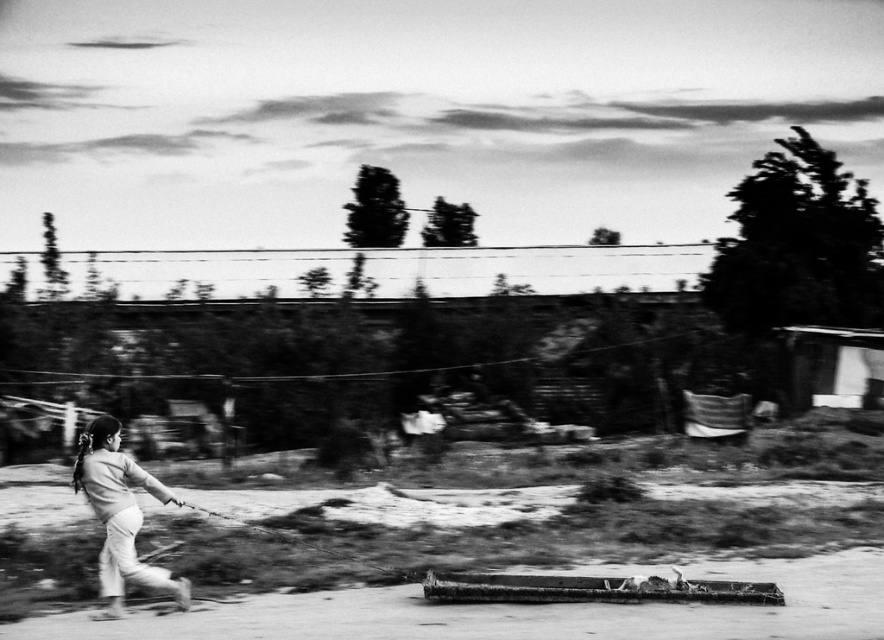
Question: Considering the relative positions of smooth dirt track at lower center and smooth skin girl at lower left in the image provided, where is smooth dirt track at lower center located with respect to smooth skin girl at lower left?

Choices:
 (A) right
 (B) left

Answer: (A)

Question: Can you confirm if smooth dirt track at lower center is wider than smooth skin girl at lower left?

Choices:
 (A) yes
 (B) no

Answer: (A)

Question: Among these points, which one is nearest to the camera?

Choices:
 (A) (234, 612)
 (B) (149, 476)

Answer: (A)

Question: Is smooth dirt track at lower center positioned in front of smooth skin girl at lower left?

Choices:
 (A) yes
 (B) no

Answer: (B)

Question: Among these objects, which one is farthest from the camera?

Choices:
 (A) smooth dirt track at lower center
 (B) smooth skin girl at lower left

Answer: (A)

Question: Which point is closer to the camera?

Choices:
 (A) smooth skin girl at lower left
 (B) smooth dirt track at lower center

Answer: (A)